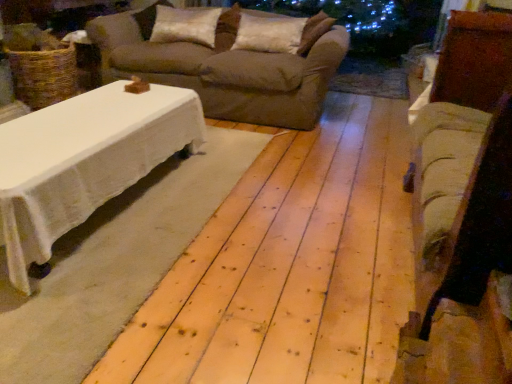
Question: Considering the relative sizes of beige fabric couch at center and satin white pillow at center, which ranks as the 2th pillow in left-to-right order, in the image provided, is beige fabric couch at center bigger than satin white pillow at center, which ranks as the 2th pillow in left-to-right order,?

Choices:
 (A) yes
 (B) no

Answer: (A)

Question: Does beige fabric couch at center lie behind satin white pillow at center, which ranks as the 1th pillow in right-to-left order?

Choices:
 (A) yes
 (B) no

Answer: (B)

Question: Does beige fabric couch at center contain satin white pillow at center, which ranks as the 2th pillow in left-to-right order?

Choices:
 (A) no
 (B) yes

Answer: (B)

Question: From a real-world perspective, is beige fabric couch at center physically above satin white pillow at center, which ranks as the 1th pillow in right-to-left order?

Choices:
 (A) yes
 (B) no

Answer: (B)

Question: From the image's perspective, would you say beige fabric couch at center is positioned over satin white pillow at center, which ranks as the 2th pillow in left-to-right order?

Choices:
 (A) no
 (B) yes

Answer: (A)

Question: Does beige fabric couch at center come in front of satin white pillow at center, which ranks as the 2th pillow in left-to-right order?

Choices:
 (A) yes
 (B) no

Answer: (A)

Question: From a real-world perspective, does beige fabric couch at center stand above white soft pillow at upper center, the second pillow when ordered from right to left?

Choices:
 (A) yes
 (B) no

Answer: (B)

Question: Does beige fabric couch at center come in front of white soft pillow at upper center, which is the first pillow from left to right?

Choices:
 (A) no
 (B) yes

Answer: (B)

Question: From a real-world perspective, is beige fabric couch at center under white soft pillow at upper center, which is the first pillow from left to right?

Choices:
 (A) no
 (B) yes

Answer: (B)

Question: Does beige fabric couch at center have a smaller size compared to white soft pillow at upper center, the second pillow when ordered from right to left?

Choices:
 (A) no
 (B) yes

Answer: (A)

Question: Is beige fabric couch at center surrounding white soft pillow at upper center, the second pillow when ordered from right to left?

Choices:
 (A) yes
 (B) no

Answer: (A)

Question: Is beige fabric couch at center to the right of white soft pillow at upper center, which is the first pillow from left to right, from the viewer's perspective?

Choices:
 (A) no
 (B) yes

Answer: (B)

Question: Is the depth of beige fabric couch at center less than that of velvet beige armchair at right?

Choices:
 (A) no
 (B) yes

Answer: (A)